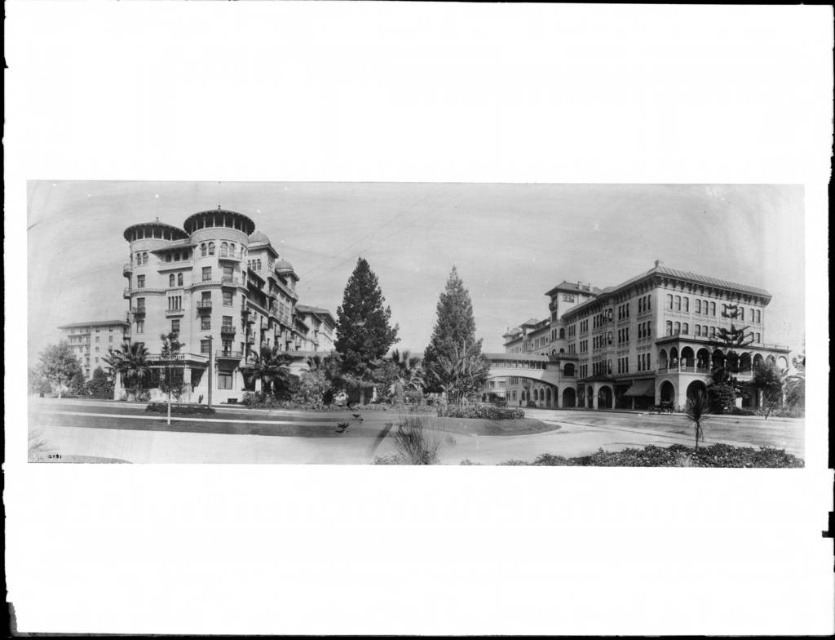
Does smooth white building at left appear over smooth tan building at center?

Indeed, smooth white building at left is positioned over smooth tan building at center.

Who is more forward, (330, 348) or (515, 358)?

Positioned in front is point (515, 358).

Image resolution: width=835 pixels, height=640 pixels. Find the location of `smooth white building at left`. smooth white building at left is located at coordinates (205, 308).